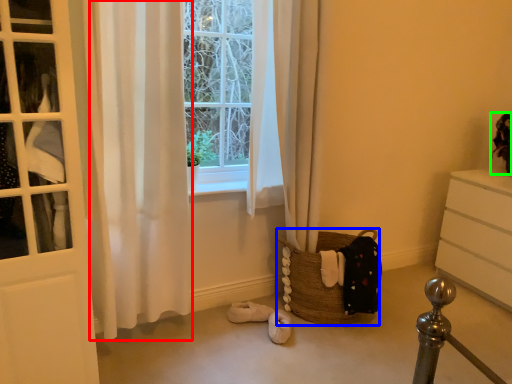
Question: Which is nearer to the curtain (highlighted by a red box)? basket (highlighted by a blue box) or doll (highlighted by a green box).

Choices:
 (A) basket
 (B) doll

Answer: (A)